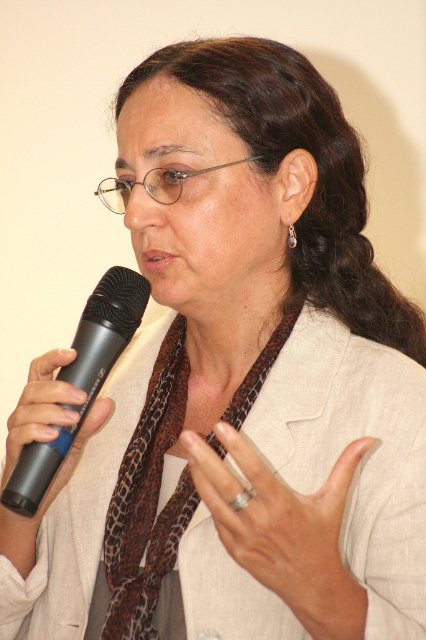
Question: Which point is farther to the camera?

Choices:
 (A) black rubber microphone at left
 (B) silver metallic ring at center

Answer: (A)

Question: Among these points, which one is farthest from the camera?

Choices:
 (A) (169, 557)
 (B) (36, 445)
 (C) (98, 310)

Answer: (A)

Question: Which object is the closest to the silver metallic ring at center?

Choices:
 (A) black matte microphone at left
 (B) black rubber microphone at left
 (C) brown leopard print scarf at center

Answer: (C)

Question: Where is silver metallic ring at center located in relation to black matte microphone at left in the image?

Choices:
 (A) below
 (B) above

Answer: (A)

Question: Is brown leopard print scarf at center wider than black matte microphone at left?

Choices:
 (A) yes
 (B) no

Answer: (A)

Question: Can you confirm if black matte microphone at left is wider than black rubber microphone at left?

Choices:
 (A) yes
 (B) no

Answer: (A)